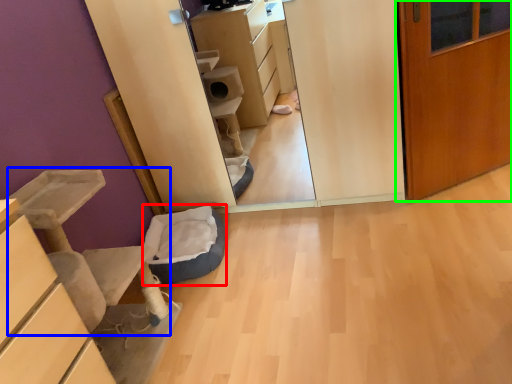
Question: Based on their relative distances, which object is nearer to cat bed (highlighted by a red box)? Choose from furniture (highlighted by a blue box) and door (highlighted by a green box).

Choices:
 (A) furniture
 (B) door

Answer: (A)